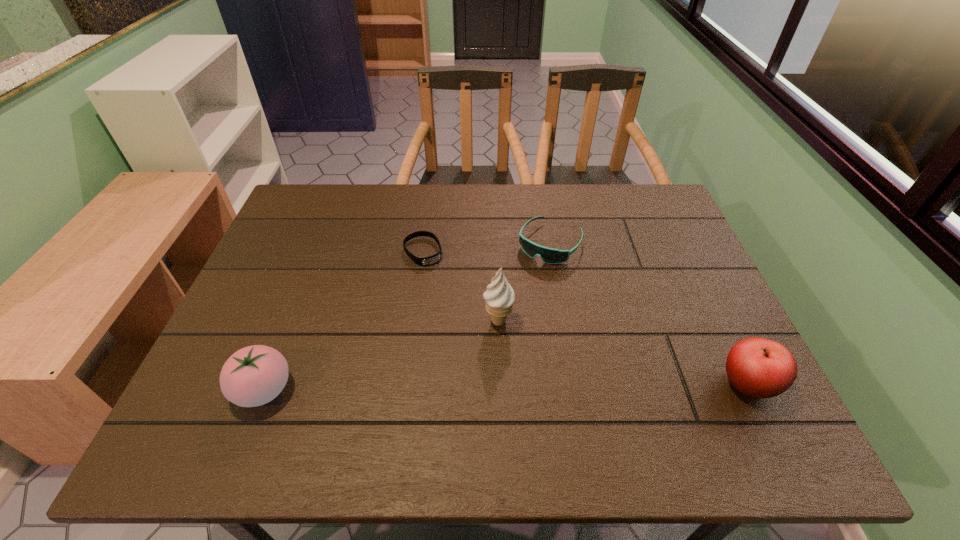
The width and height of the screenshot is (960, 540). I want to click on tomato present at the near edge, so [x=253, y=376].

Where is `apple that is at the near edge`? This screenshot has height=540, width=960. apple that is at the near edge is located at coordinates (760, 368).

At what (x,y) coordinates should I click in order to perform the action: click on object at the left edge. Please return your answer as a coordinate pair (x, y). The width and height of the screenshot is (960, 540). Looking at the image, I should click on (253, 376).

This screenshot has height=540, width=960. Identify the location of object located at the right edge. (760, 368).

At what (x,y) coordinates should I click in order to perform the action: click on object at the near left corner. Please return your answer as a coordinate pair (x, y). Looking at the image, I should click on (253, 376).

Find the location of a particular element. object located in the near right corner section of the desktop is located at coordinates (760, 368).

The width and height of the screenshot is (960, 540). I want to click on vacant area at the far edge, so click(x=396, y=196).

The height and width of the screenshot is (540, 960). I want to click on free location at the near edge, so click(588, 390).

The height and width of the screenshot is (540, 960). Find the location of `vacant space at the left edge`. vacant space at the left edge is located at coordinates 254,321.

Where is `free space at the right edge of the desktop`? The image size is (960, 540). free space at the right edge of the desktop is located at coordinates (712, 300).